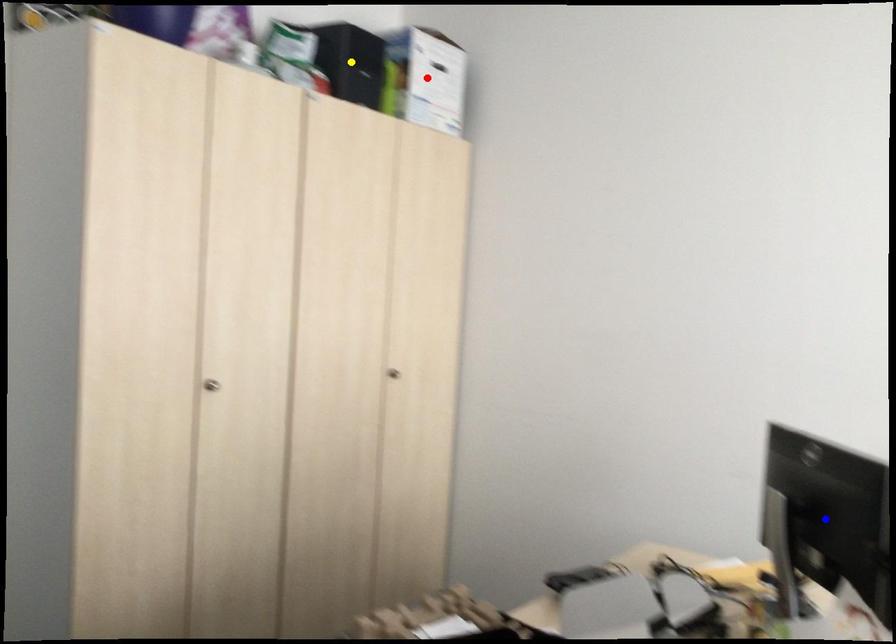
Order these from nearest to farthest:
yellow point
red point
blue point

blue point
yellow point
red point